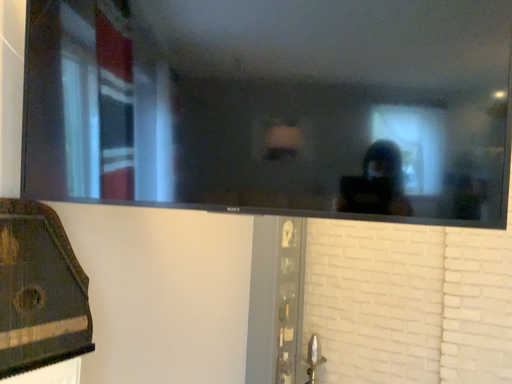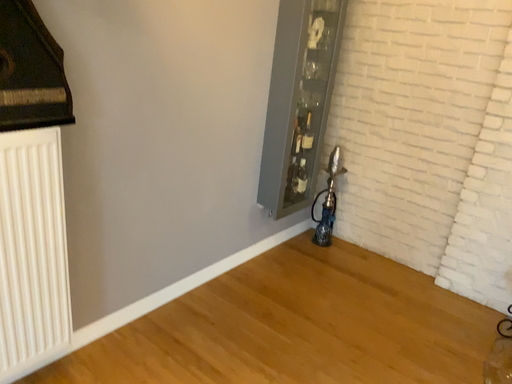
Question: How did the camera likely rotate when shooting the video?

Choices:
 (A) rotated upward
 (B) rotated downward

Answer: (B)